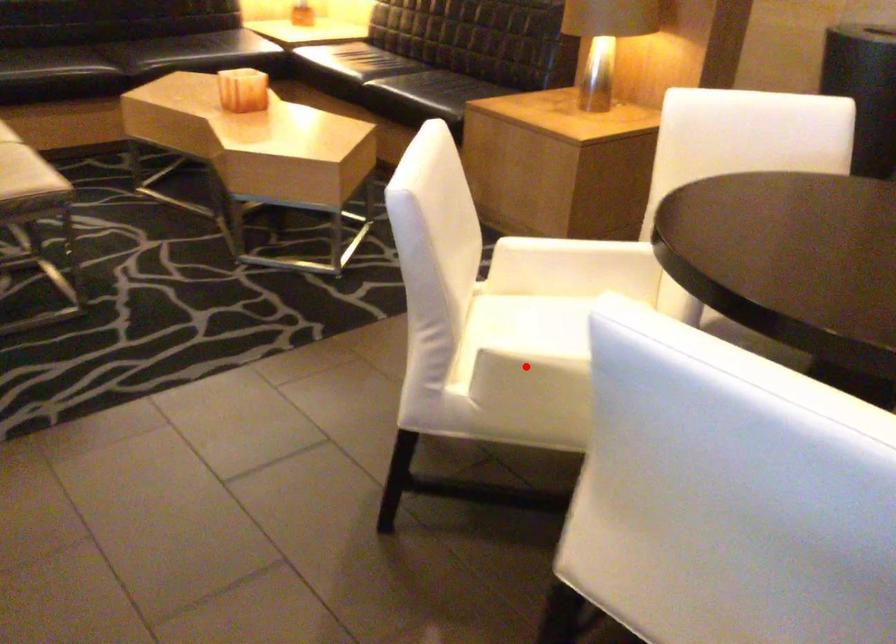
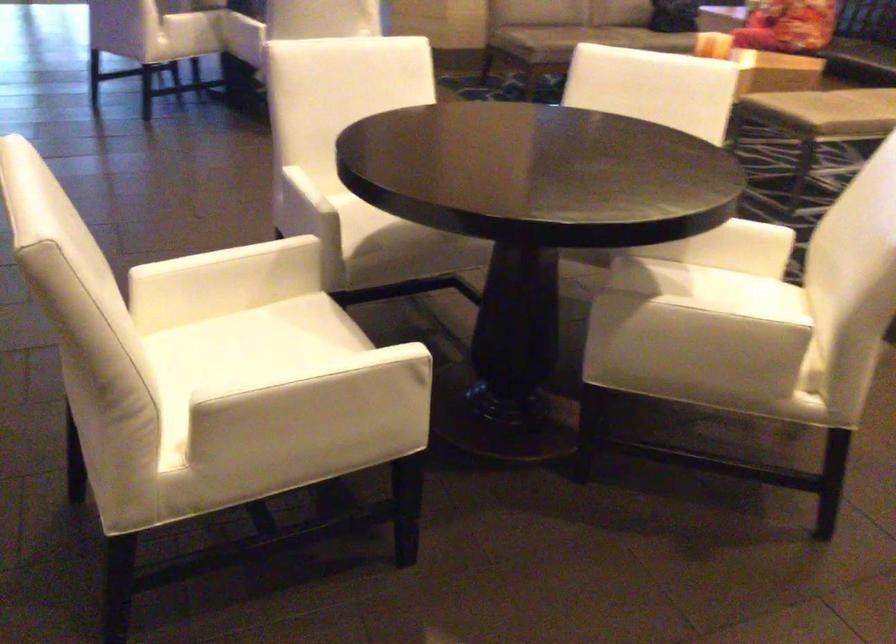
Question: I am providing you with two images of the same scene from different viewpoints. A red point is marked on the first image. At the location where the point appears in image 1, is it still visible in image 2?

Choices:
 (A) Yes
 (B) No

Answer: (B)